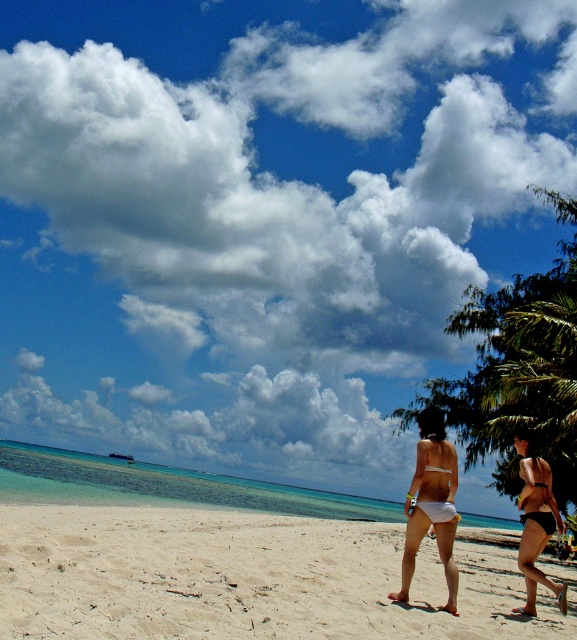
You are a photographer standing at the edge of the white sandy beach at center. You want to take a photo of the matte black bikini at lower right without including the palm trees in the background. Based on their positions, can you achieve this by adjusting your camera angle?

The white sandy beach at center is positioned under the matte black bikini at lower right, so if you lower your camera angle to focus on the bikini while angling slightly downward, you can frame the shot to exclude the palm trees in the background.

You are a photographer trying to capture the entire white sandy beach at center and the white matte bikini bottom at center in one frame. Which object will appear wider in the photo?

The white sandy beach at center will appear wider in the photo because its width is larger than that of the white matte bikini bottom at center according to the description.